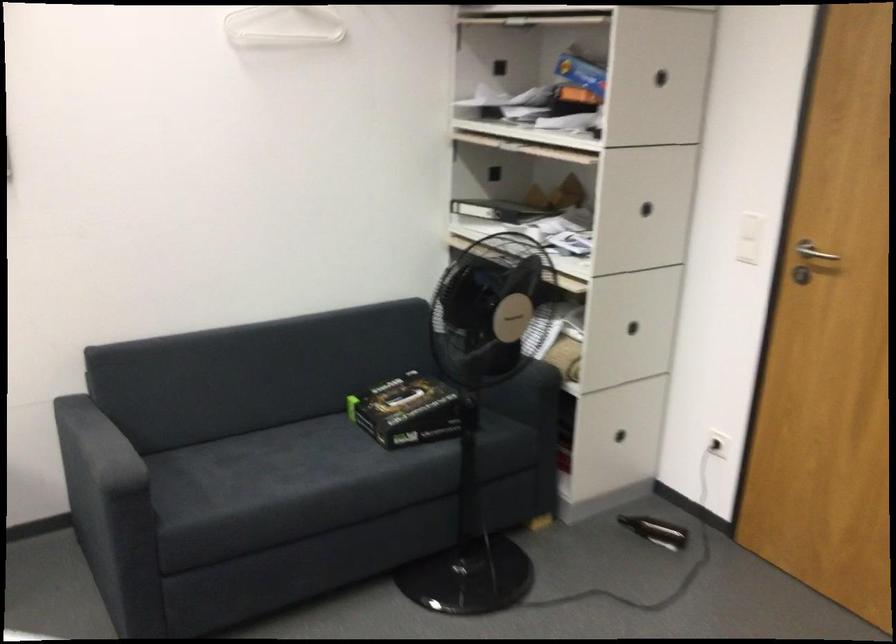
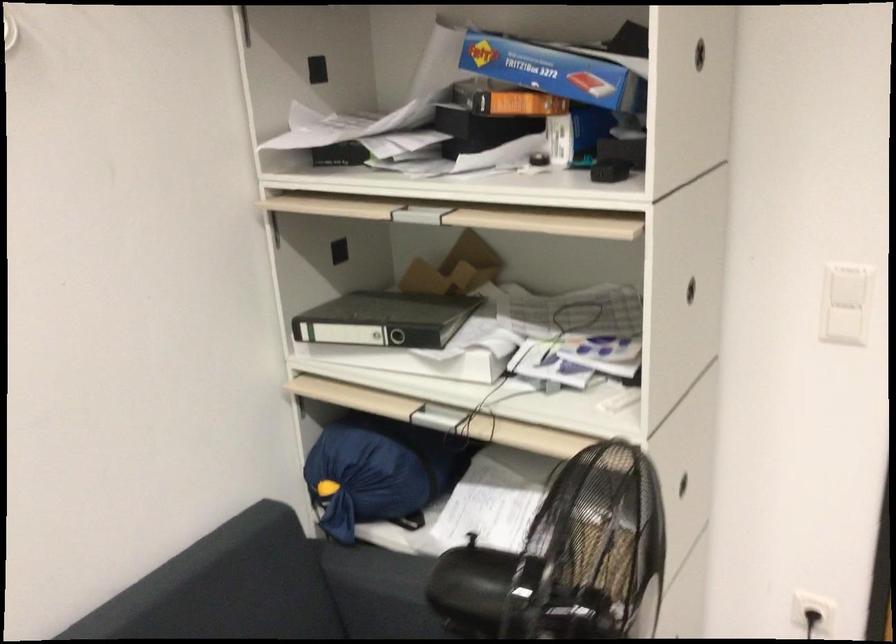
In the second image, find the point that corresponds to (x=593, y=73) in the first image.

(553, 71)